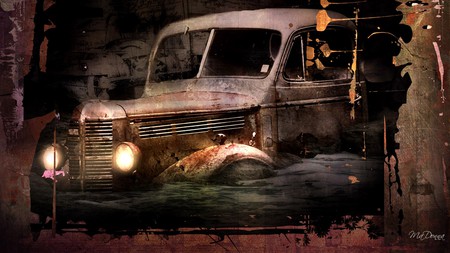
Identify the location of window. The height and width of the screenshot is (253, 450). (323, 59).